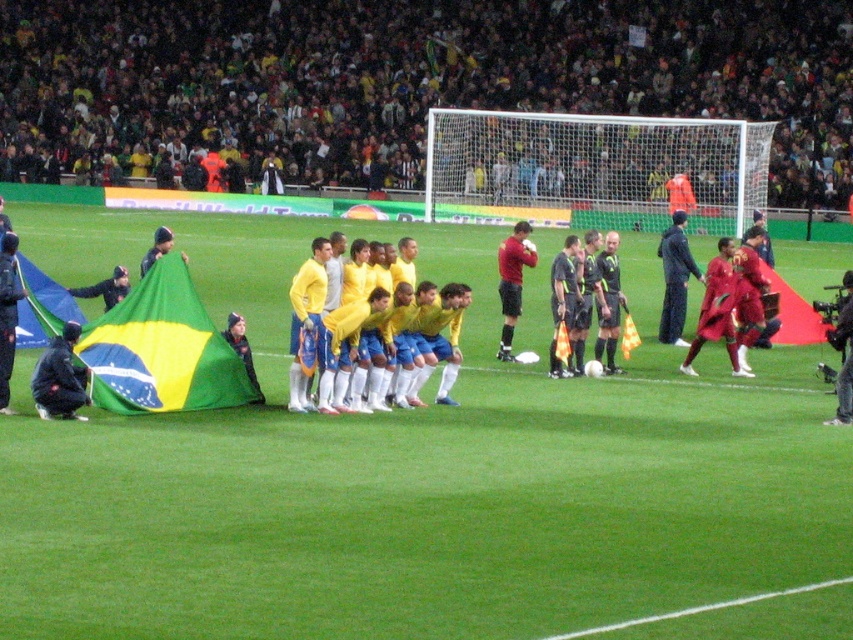
You are a soccer player standing at the edge of the field. You need to reach a ball placed at point (410, 470) on the field. Which direction should you walk to get there?

The point (410, 470) is on the green grass field at center, so you should walk towards the center of the field to reach it.

You are a photographer standing at the edge of the soccer field. You want to take a picture of the green grass field at center and the black matte jacket at lower left. Which object will appear larger in the photo?

The green grass field at center will appear larger in the photo because it has a greater height compared to the black matte jacket at lower left.

You are a photographer standing at the center of the soccer field during the ceremony. You want to take a photo that includes both the point at the left team and the point at the right team. Which point should you focus on first to ensure both are in focus? The points are labeled as point [688,243] and point [599,625].

You should focus on point [688,243] first because it is closer to the camera than point [599,625]. This ensures that both points will be within the depth of field when focused on the closer point.